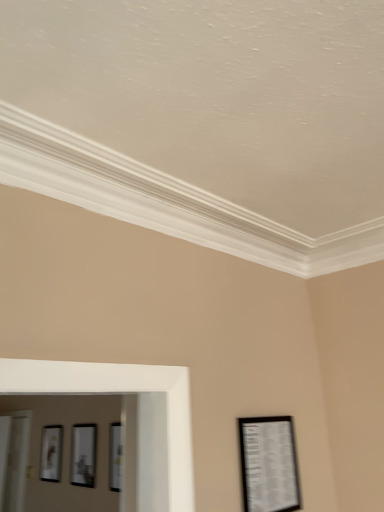
I want to click on matte black picture frame at left, the 1th picture frame in the bottom-to-top sequence, so click(51, 453).

Consider the image. What's the angular difference between matte black picture frame at center, the second picture frame viewed from the top, and matte black picture frame at lower right, which is the third picture frame in left-to-right order,'s facing directions?

90.9 degrees separate the facing orientations of matte black picture frame at center, the second picture frame viewed from the top, and matte black picture frame at lower right, which is the third picture frame in left-to-right order.

Does matte black picture frame at center, positioned as the second picture frame in right-to-left order, appear on the right side of matte black picture frame at lower right, marked as the 1th picture frame in a top-to-bottom arrangement?

Incorrect, matte black picture frame at center, positioned as the second picture frame in right-to-left order, is not on the right side of matte black picture frame at lower right, marked as the 1th picture frame in a top-to-bottom arrangement.

Which is behind, point (87, 478) or point (248, 437)?

The point (87, 478) is more distant.

At what (x,y) coordinates should I click in order to perform the action: click on picture frame that is the 1st one when counting backward from the matte black picture frame at lower right, which is the first picture frame from front to back. Please return your answer as a coordinate pair (x, y). The width and height of the screenshot is (384, 512). Looking at the image, I should click on (83, 455).

Considering the sizes of matte black picture frame at lower right, the third picture frame in the back-to-front sequence, and matte black picture frame at center, placed as the 2th picture frame when sorted from left to right, in the image, is matte black picture frame at lower right, the third picture frame in the back-to-front sequence, wider or thinner than matte black picture frame at center, placed as the 2th picture frame when sorted from left to right,?

Clearly, matte black picture frame at lower right, the third picture frame in the back-to-front sequence, has less width compared to matte black picture frame at center, placed as the 2th picture frame when sorted from left to right.

Could you tell me if matte black picture frame at lower right, which is the third picture frame in left-to-right order, is facing matte black picture frame at center, placed as the 2th picture frame when sorted from left to right?

No, matte black picture frame at lower right, which is the third picture frame in left-to-right order, does not turn towards matte black picture frame at center, placed as the 2th picture frame when sorted from left to right.

Considering the sizes of objects matte black picture frame at lower right, the first picture frame viewed from the right, and matte black picture frame at center, the second picture frame viewed from the top, in the image provided, who is shorter, matte black picture frame at lower right, the first picture frame viewed from the right, or matte black picture frame at center, the second picture frame viewed from the top,?

With less height is matte black picture frame at lower right, the first picture frame viewed from the right.

From the image's perspective, which is above, matte black picture frame at lower right, the first picture frame viewed from the right, or matte black picture frame at left, the 3th picture frame from the top?

From the image's view, matte black picture frame at lower right, the first picture frame viewed from the right, is above.

Can you tell me how much matte black picture frame at lower right, the 3th picture frame ordered from the bottom, and matte black picture frame at left, the 1th picture frame in the bottom-to-top sequence, differ in facing direction?

The angle between the facing direction of matte black picture frame at lower right, the 3th picture frame ordered from the bottom, and the facing direction of matte black picture frame at left, the 1th picture frame in the bottom-to-top sequence, is 91.3 degrees.

From a real-world perspective, which is physically above, matte black picture frame at lower right, which is the third picture frame in left-to-right order, or matte black picture frame at left, arranged as the 3th picture frame when viewed from the front?

In real-world perspective, matte black picture frame at lower right, which is the third picture frame in left-to-right order, is above.

This screenshot has height=512, width=384. What are the coordinates of `the 2nd picture frame in front of the matte black picture frame at left, which is the 1th picture frame in back-to-front order, counting from the anchor's position` in the screenshot? It's located at (269, 464).

Does matte black picture frame at left, the 1th picture frame in the bottom-to-top sequence, have a greater width compared to matte black picture frame at lower right, which is the third picture frame in left-to-right order?

Yes, matte black picture frame at left, the 1th picture frame in the bottom-to-top sequence, is wider than matte black picture frame at lower right, which is the third picture frame in left-to-right order.

Does point (49, 478) come closer to viewer compared to point (249, 444)?

No, (49, 478) is further to viewer.

Is matte black picture frame at left, arranged as the 3th picture frame when viewed from the front, touching matte black picture frame at lower right, the first picture frame viewed from the right?

matte black picture frame at left, arranged as the 3th picture frame when viewed from the front, is not next to matte black picture frame at lower right, the first picture frame viewed from the right, and they're not touching.

Based on the photo, could matte black picture frame at lower right, which is the first picture frame from front to back, be considered to be inside matte black picture frame at left, which is the 1th picture frame in back-to-front order?

No, matte black picture frame at lower right, which is the first picture frame from front to back, is not surrounded by matte black picture frame at left, which is the 1th picture frame in back-to-front order.

Is matte black picture frame at left, the 3th picture frame positioned from the right, not close to matte black picture frame at center, placed as the 2th picture frame when sorted from left to right?

matte black picture frame at left, the 3th picture frame positioned from the right, is near matte black picture frame at center, placed as the 2th picture frame when sorted from left to right, not far away.

Does point (58, 463) come farther from viewer compared to point (95, 458)?

Yes, point (58, 463) is behind point (95, 458).

From a real-world perspective, who is located lower, matte black picture frame at left, which is the 1th picture frame in back-to-front order, or matte black picture frame at center, positioned as the second picture frame in right-to-left order?

matte black picture frame at center, positioned as the second picture frame in right-to-left order, from a real-world perspective.

Is matte black picture frame at center, which ranks as the second picture frame in back-to-front order, positioned behind matte black picture frame at left, the first picture frame from the left?

No, matte black picture frame at center, which ranks as the second picture frame in back-to-front order, is closer to the camera.

From a real-world perspective, which object rests below the other?

matte black picture frame at center, the second picture frame from the front, from a real-world perspective.

Can you tell me how much matte black picture frame at center, which ranks as the second picture frame in back-to-front order, and matte black picture frame at left, the 3th picture frame positioned from the right, differ in facing direction?

The angle between the facing direction of matte black picture frame at center, which ranks as the second picture frame in back-to-front order, and the facing direction of matte black picture frame at left, the 3th picture frame positioned from the right, is 0.456 degrees.

Considering the positions of point (86, 426) and point (45, 439), is point (86, 426) closer or farther from the camera than point (45, 439)?

Point (86, 426).

Identify the location of the 2nd picture frame directly beneath the matte black picture frame at lower right, marked as the 1th picture frame in a top-to-bottom arrangement (from a real-world perspective). This screenshot has height=512, width=384. 83,455.

Which picture frame is the 1st one when counting from the back of the matte black picture frame at lower right, the first picture frame viewed from the right? Please provide its 2D coordinates.

[(83, 455)]

Considering their positions, is matte black picture frame at left, the first picture frame from the left, positioned closer to matte black picture frame at center, positioned as the second picture frame in right-to-left order, than matte black picture frame at lower right, which is the third picture frame in left-to-right order?

matte black picture frame at left, the first picture frame from the left, is closer to matte black picture frame at center, positioned as the second picture frame in right-to-left order.

Looking at the image, which one is located closer to matte black picture frame at left, which is the 1th picture frame in back-to-front order, matte black picture frame at lower right, the 3th picture frame ordered from the bottom, or matte black picture frame at center, which ranks as the second picture frame in back-to-front order?

matte black picture frame at center, which ranks as the second picture frame in back-to-front order, lies closer to matte black picture frame at left, which is the 1th picture frame in back-to-front order, than the other object.

Considering their positions, is matte black picture frame at left, the first picture frame from the left, positioned closer to matte black picture frame at lower right, the third picture frame in the back-to-front sequence, than matte black picture frame at center, the second picture frame viewed from the top?

Among the two, matte black picture frame at center, the second picture frame viewed from the top, is located nearer to matte black picture frame at lower right, the third picture frame in the back-to-front sequence.

Which object lies nearer to the anchor point matte black picture frame at lower right, which is the third picture frame in left-to-right order, matte black picture frame at center, acting as the 2th picture frame starting from the bottom, or matte black picture frame at left, the 3th picture frame positioned from the right?

Based on the image, matte black picture frame at center, acting as the 2th picture frame starting from the bottom, appears to be nearer to matte black picture frame at lower right, which is the third picture frame in left-to-right order.

Based on their spatial positions, is matte black picture frame at center, placed as the 2th picture frame when sorted from left to right, or matte black picture frame at lower right, the 3th picture frame ordered from the bottom, closer to matte black picture frame at left, the 1th picture frame in the bottom-to-top sequence?

matte black picture frame at center, placed as the 2th picture frame when sorted from left to right, is closer to matte black picture frame at left, the 1th picture frame in the bottom-to-top sequence.

Looking at the image, which one is located closer to matte black picture frame at center, the second picture frame from the front, matte black picture frame at lower right, the first picture frame viewed from the right, or matte black picture frame at left, the 3th picture frame from the top?

The object closer to matte black picture frame at center, the second picture frame from the front, is matte black picture frame at left, the 3th picture frame from the top.

Locate an element on the screen. picture frame between matte black picture frame at lower right, which is the third picture frame in left-to-right order, and matte black picture frame at left, the 3th picture frame from the top, from front to back is located at coordinates (83, 455).